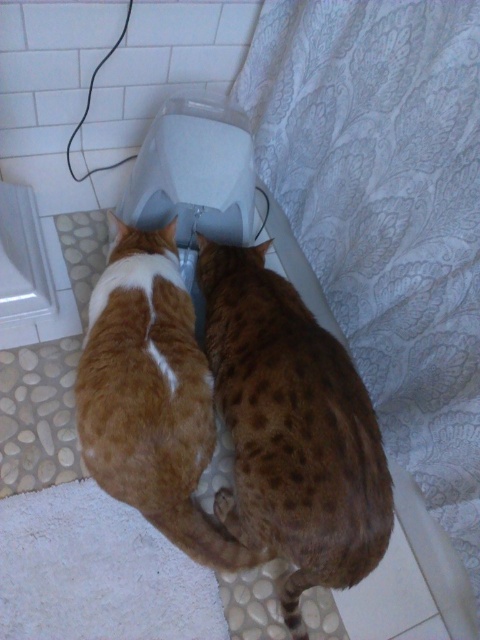
Question: Is spotted fur cat at center further to camera compared to orange fur cat at center?

Choices:
 (A) yes
 (B) no

Answer: (B)

Question: Among these objects, which one is farthest from the camera?

Choices:
 (A) spotted fur cat at center
 (B) orange fur cat at center

Answer: (B)

Question: Is spotted fur cat at center thinner than orange fur cat at center?

Choices:
 (A) no
 (B) yes

Answer: (A)

Question: Considering the relative positions of spotted fur cat at center and orange fur cat at center in the image provided, where is spotted fur cat at center located with respect to orange fur cat at center?

Choices:
 (A) above
 (B) below

Answer: (B)

Question: Which of the following is the farthest from the observer?

Choices:
 (A) orange fur cat at center
 (B) spotted fur cat at center

Answer: (A)

Question: Among these objects, which one is nearest to the camera?

Choices:
 (A) spotted fur cat at center
 (B) orange fur cat at center

Answer: (A)